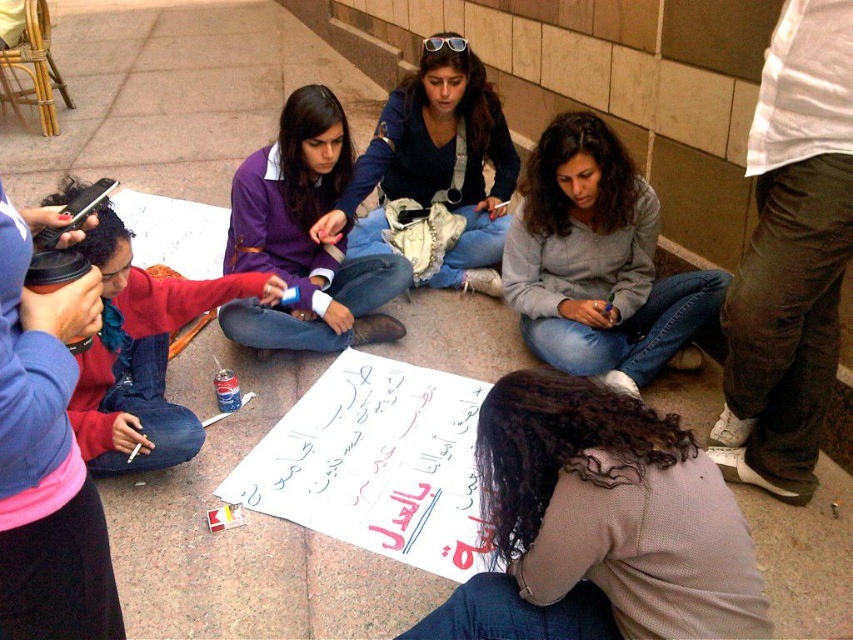
Can you confirm if gray matte sweater at center is positioned above blue denim jeans at center?

Incorrect, gray matte sweater at center is not positioned above blue denim jeans at center.

Who is positioned more to the right, gray matte sweater at center or blue denim jeans at center?

gray matte sweater at center is more to the right.

What do you see at coordinates (596, 260) in the screenshot?
I see `gray matte sweater at center` at bounding box center [596, 260].

The height and width of the screenshot is (640, 853). What are the coordinates of `gray matte sweater at center` in the screenshot? It's located at (596, 260).

Is light brown sweater at lower center smaller than blue denim jeans at center?

Yes, light brown sweater at lower center is smaller than blue denim jeans at center.

Can you confirm if light brown sweater at lower center is positioned below blue denim jeans at center?

Indeed, light brown sweater at lower center is positioned under blue denim jeans at center.

The height and width of the screenshot is (640, 853). Describe the element at coordinates (599, 524) in the screenshot. I see `light brown sweater at lower center` at that location.

Identify the location of light brown sweater at lower center. The height and width of the screenshot is (640, 853). (599, 524).

Measure the distance between gray matte sweater at center and purple fabric shirt at upper center.

27.76 inches

Which is more to the left, gray matte sweater at center or purple fabric shirt at upper center?

From the viewer's perspective, purple fabric shirt at upper center appears more on the left side.

Which is in front, point (590, 120) or point (309, 282)?

Point (590, 120)

I want to click on gray matte sweater at center, so click(x=596, y=260).